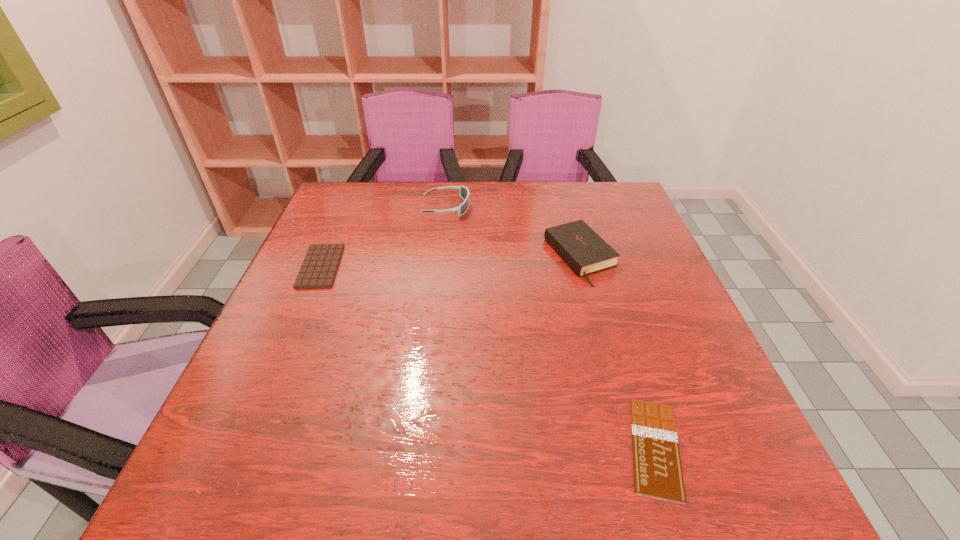
Identify the location of free space between the second tallest object and the taller chocolate bar. (450, 261).

Find the location of a particular element. This screenshot has height=540, width=960. free area in between the Bible and the third object from right to left is located at coordinates (514, 232).

Locate an element on the screen. This screenshot has width=960, height=540. empty space between the farthest object and the nearer chocolate bar is located at coordinates (551, 327).

Image resolution: width=960 pixels, height=540 pixels. What are the coordinates of `the closest object to the second object from left to right` in the screenshot? It's located at (580, 247).

Image resolution: width=960 pixels, height=540 pixels. Find the location of `the closest object relative to the goggles`. the closest object relative to the goggles is located at coordinates (580, 247).

The height and width of the screenshot is (540, 960). I want to click on vacant region that satisfies the following two spatial constraints: 1. on the front-facing side of the shortest object; 2. on the left side of the second object from left to right, so click(420, 447).

At what (x,y) coordinates should I click in order to perform the action: click on vacant point that satisfies the following two spatial constraints: 1. on the front-facing side of the tallest object; 2. on the back side of the shorter chocolate bar. Please return your answer as a coordinate pair (x, y). Looking at the image, I should click on (420, 447).

Identify the location of vacant space that satisfies the following two spatial constraints: 1. on the front side of the nearer chocolate bar; 2. on the left side of the third tallest object. (244, 447).

Where is `free region that satisfies the following two spatial constraints: 1. on the back side of the shortest object; 2. on the front-facing side of the farthest object`? free region that satisfies the following two spatial constraints: 1. on the back side of the shortest object; 2. on the front-facing side of the farthest object is located at coordinates (580, 207).

Image resolution: width=960 pixels, height=540 pixels. What are the coordinates of `free location that satisfies the following two spatial constraints: 1. on the front-facing side of the right chocolate bar; 2. on the right side of the farthest object` in the screenshot? It's located at (420, 447).